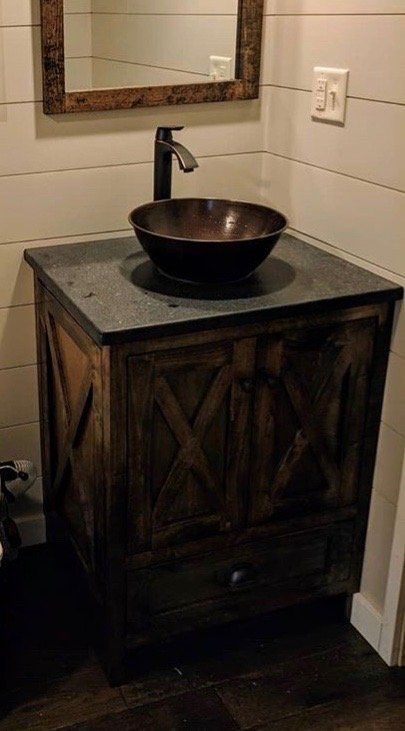
Find the location of `doorway`. doorway is located at coordinates (401, 526), (396, 571), (389, 624).